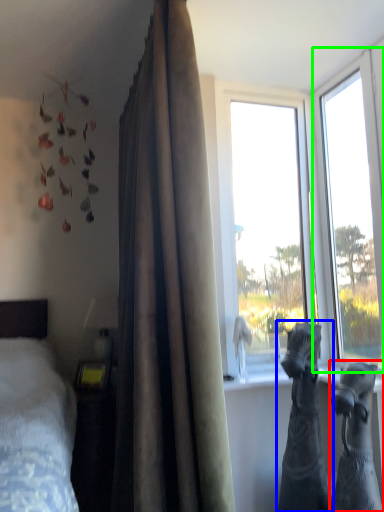
Question: Considering the real-world distances, which object is closest to animal (highlighted by a red box)? animal (highlighted by a blue box) or window (highlighted by a green box).

Choices:
 (A) animal
 (B) window

Answer: (A)